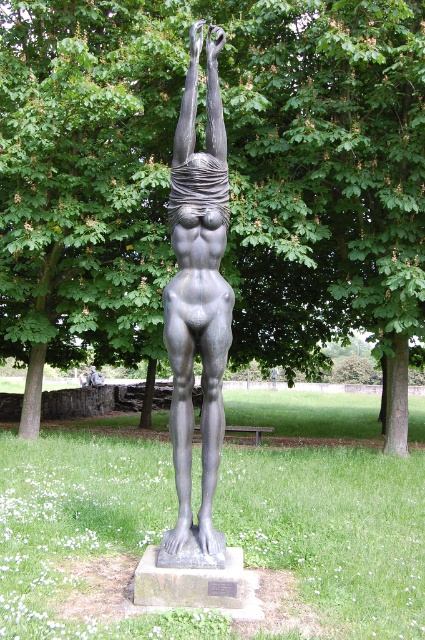
Question: Which of the following is the farthest from the observer?

Choices:
 (A) (47, 291)
 (B) (190, 317)

Answer: (A)

Question: Which object is farther from the camera taking this photo?

Choices:
 (A) green leafy tree at center
 (B) matte bronze statue at center

Answer: (A)

Question: Can you confirm if green leafy tree at center is smaller than matte bronze statue at center?

Choices:
 (A) yes
 (B) no

Answer: (B)

Question: Which point is farther from the camera taking this photo?

Choices:
 (A) click(x=186, y=211)
 (B) click(x=291, y=65)

Answer: (B)

Question: Is green leafy tree at center to the left of matte bronze statue at center from the viewer's perspective?

Choices:
 (A) no
 (B) yes

Answer: (B)

Question: Is green leafy tree at center below matte bronze statue at center?

Choices:
 (A) no
 (B) yes

Answer: (A)